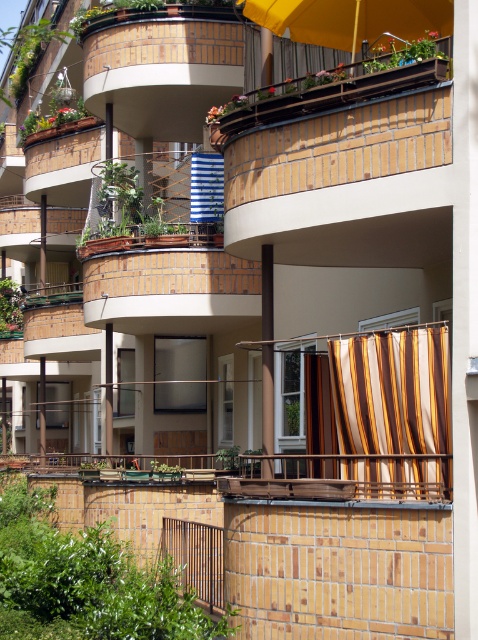
You are standing in front of the residential building and want to know how far the point at coordinate (422, 458) is from you. Can you determine the distance?

The point at coordinate (422, 458) is 18.87 meters away from the viewer.

You are a painter standing on the ground floor of the building and want to paint the yellow fabric umbrella at upper center and the blue striped fabric at upper center. Which object is wider?

The yellow fabric umbrella at upper center might be wider than blue striped fabric at upper center according to the description.

You are standing in front of the residential building and notice two decorative items. One is the striped fabric curtain at lower right and the other is the yellow fabric umbrella at upper center. Which of these two items is positioned to the right side of the other?

The striped fabric curtain at lower right is positioned to the right of the yellow fabric umbrella at upper center.